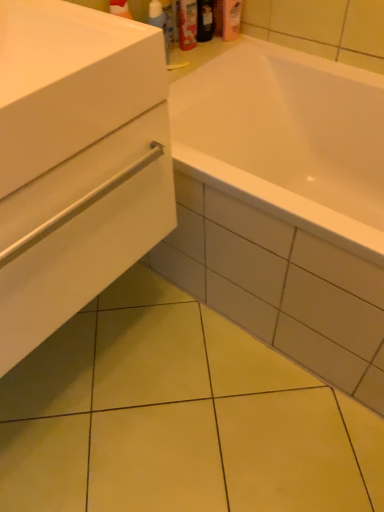
Question: Considering the relative positions of matte plastic shampoo bottle at upper center, the 3th toiletry in the right-to-left sequence, and translucent plastic spray bottle at upper center in the image provided, is matte plastic shampoo bottle at upper center, the 3th toiletry in the right-to-left sequence, to the left of translucent plastic spray bottle at upper center from the viewer's perspective?

Choices:
 (A) yes
 (B) no

Answer: (B)

Question: From the image's perspective, does matte plastic shampoo bottle at upper center, arranged as the 1th toiletry when viewed from the left, appear lower than translucent plastic spray bottle at upper center?

Choices:
 (A) no
 (B) yes

Answer: (A)

Question: Considering the relative sizes of matte plastic shampoo bottle at upper center, the 3th toiletry in the right-to-left sequence, and translucent plastic spray bottle at upper center in the image provided, is matte plastic shampoo bottle at upper center, the 3th toiletry in the right-to-left sequence, thinner than translucent plastic spray bottle at upper center?

Choices:
 (A) no
 (B) yes

Answer: (A)

Question: Is matte plastic shampoo bottle at upper center, arranged as the 1th toiletry when viewed from the left, positioned with its back to translucent plastic spray bottle at upper center?

Choices:
 (A) no
 (B) yes

Answer: (A)

Question: Is matte plastic shampoo bottle at upper center, the 3th toiletry in the right-to-left sequence, smaller than translucent plastic spray bottle at upper center?

Choices:
 (A) no
 (B) yes

Answer: (A)

Question: Does matte plastic shampoo bottle at upper center, the 3th toiletry in the right-to-left sequence, have a lesser height compared to translucent plastic spray bottle at upper center?

Choices:
 (A) no
 (B) yes

Answer: (A)

Question: Is white glossy sink at left looking in the opposite direction of pink matte lotion at upper center, marked as the 1th toiletry in a right-to-left arrangement?

Choices:
 (A) no
 (B) yes

Answer: (A)

Question: From the image's perspective, is white glossy sink at left on pink matte lotion at upper center, marked as the 1th toiletry in a right-to-left arrangement?

Choices:
 (A) no
 (B) yes

Answer: (A)

Question: Is white glossy sink at left not within pink matte lotion at upper center, marked as the 1th toiletry in a right-to-left arrangement?

Choices:
 (A) yes
 (B) no

Answer: (A)

Question: Does white glossy sink at left come behind pink matte lotion at upper center, placed as the third toiletry when sorted from left to right?

Choices:
 (A) no
 (B) yes

Answer: (A)

Question: Does white glossy sink at left appear on the right side of pink matte lotion at upper center, marked as the 1th toiletry in a right-to-left arrangement?

Choices:
 (A) no
 (B) yes

Answer: (A)

Question: Can you confirm if white glossy sink at left is shorter than pink matte lotion at upper center, placed as the third toiletry when sorted from left to right?

Choices:
 (A) no
 (B) yes

Answer: (B)

Question: Is white matte drawer at lower left aimed at white glossy sink at left?

Choices:
 (A) yes
 (B) no

Answer: (B)